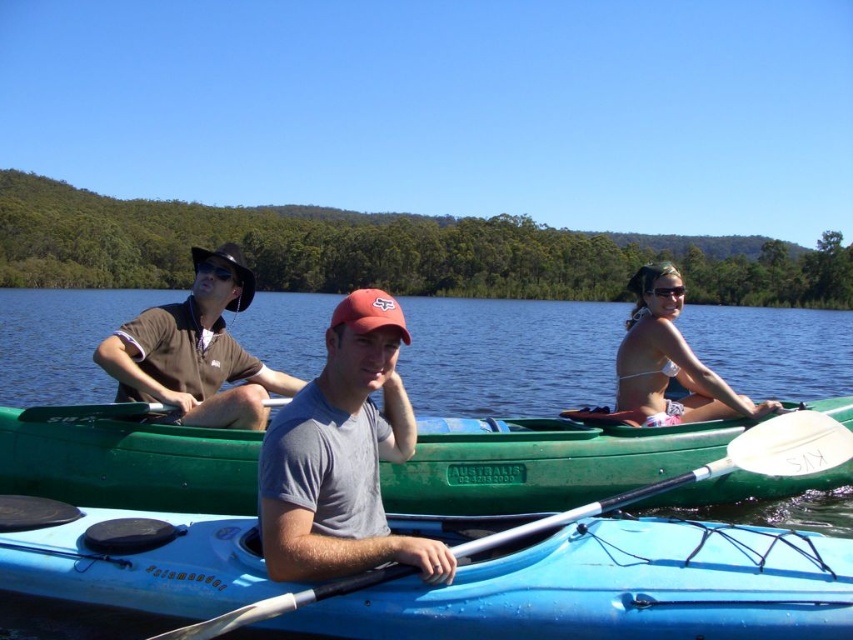
Question: Which is farther from the white bikini at center?

Choices:
 (A) green plastic kayak at center
 (B) gray matte t-shirt at center
 (C) transparent plastic goggles at upper center

Answer: (A)

Question: Considering the relative positions of blue water at center and white plastic paddle at center in the image provided, where is blue water at center located with respect to white plastic paddle at center?

Choices:
 (A) right
 (B) left

Answer: (B)

Question: Is green plastic kayak at center positioned before gray matte t-shirt at center?

Choices:
 (A) no
 (B) yes

Answer: (A)

Question: Which object is the closest to the white bikini at center?

Choices:
 (A) white plastic paddle at center
 (B) brown cotton shirt at upper left

Answer: (A)

Question: Among these objects, which one is nearest to the camera?

Choices:
 (A) blue water at center
 (B) white bikini at center
 (C) white plastic paddle at center

Answer: (C)

Question: Does green plastic kayak at center come in front of gray matte t-shirt at center?

Choices:
 (A) no
 (B) yes

Answer: (A)